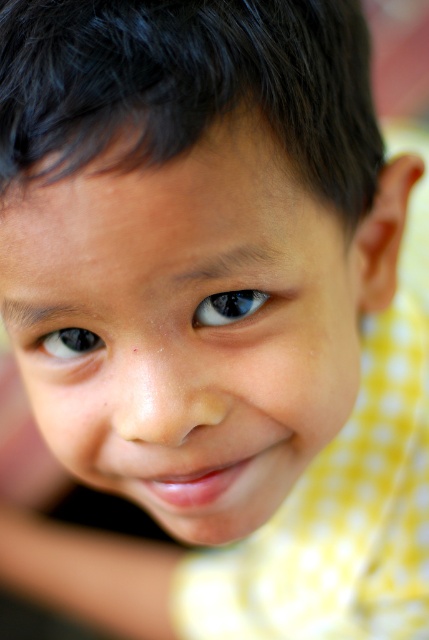
Between point (328, 284) and point (227, 317), which one is positioned in front?

Point (227, 317)

Does smooth skin face at center have a greater width compared to blue glossy eye at center?

Correct, the width of smooth skin face at center exceeds that of blue glossy eye at center.

Between point (36, 182) and point (254, 291), which one is positioned behind?

Positioned behind is point (254, 291).

Identify the location of smooth skin face at center. Image resolution: width=429 pixels, height=640 pixels. (186, 326).

Can you confirm if blue glossy eye at center is positioned to the right of black glossy eye at center?

Yes, blue glossy eye at center is to the right of black glossy eye at center.

Does blue glossy eye at center have a smaller size compared to black glossy eye at center?

Yes, blue glossy eye at center is smaller than black glossy eye at center.

Where is `blue glossy eye at center`? This screenshot has height=640, width=429. blue glossy eye at center is located at coordinates (227, 307).

Locate an element on the screen. The width and height of the screenshot is (429, 640). blue glossy eye at center is located at coordinates (227, 307).

Which is behind, point (142, 285) or point (59, 333)?

Positioned behind is point (59, 333).

Is smooth skin face at center to the left of black glossy eye at center from the viewer's perspective?

No, smooth skin face at center is not to the left of black glossy eye at center.

Is point (114, 209) less distant than point (94, 348)?

Yes, point (114, 209) is closer to viewer.

Where is `smooth skin face at center`? This screenshot has width=429, height=640. smooth skin face at center is located at coordinates (186, 326).